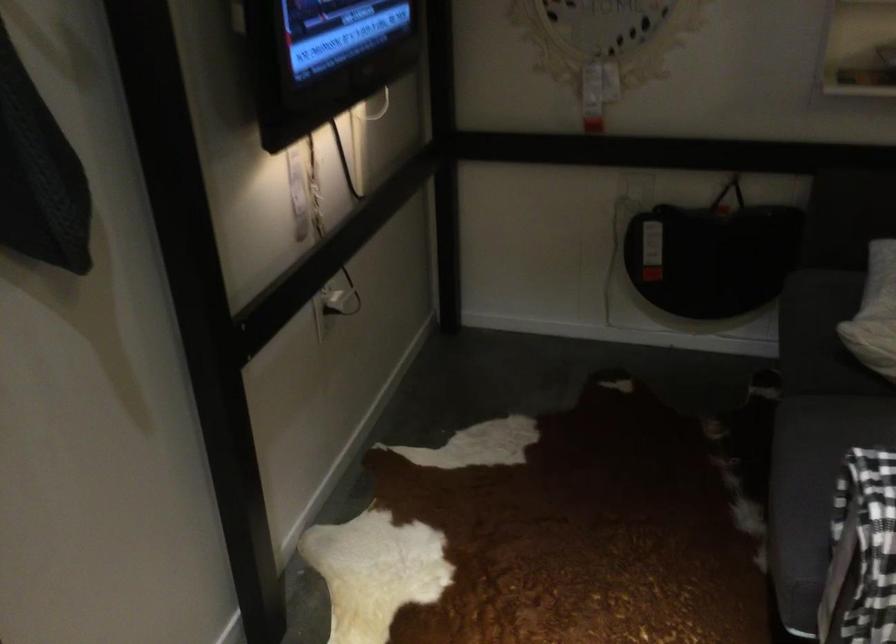
Locate an element on the screen. Image resolution: width=896 pixels, height=644 pixels. sofa sitting surface is located at coordinates (805, 494).